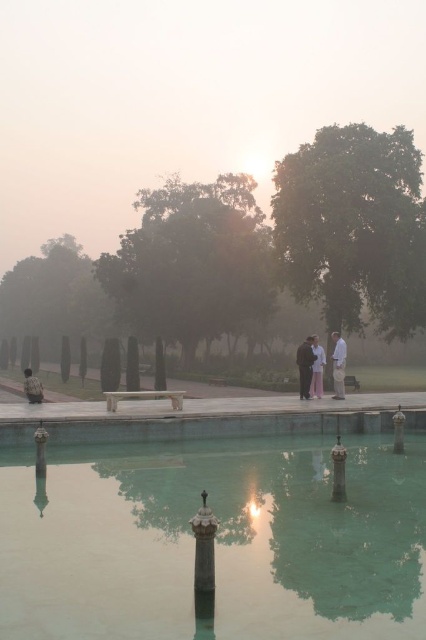
Question: Is white marble pillar at center smaller than white cotton pants at center?

Choices:
 (A) yes
 (B) no

Answer: (A)

Question: Is green marble swimming pool at center closer to the viewer compared to white cotton pants at center?

Choices:
 (A) yes
 (B) no

Answer: (A)

Question: Does dark brown suit at center have a larger size compared to rain-soaked jacket at lower center?

Choices:
 (A) no
 (B) yes

Answer: (B)

Question: Estimate the real-world distances between objects in this image. Which object is closer to the white marble pillar at center?

Choices:
 (A) rain-soaked jacket at lower center
 (B) white cotton pants at center

Answer: (A)

Question: Which of the following is the closest to the observer?

Choices:
 (A) (322, 372)
 (B) (307, 360)
 (C) (350, 448)

Answer: (C)

Question: Which of the following is the farthest from the observer?

Choices:
 (A) (340, 342)
 (B) (321, 358)

Answer: (A)